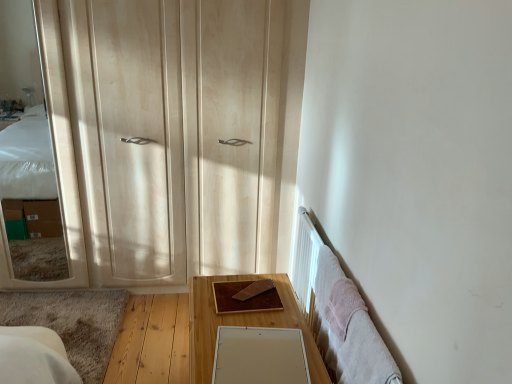
You are a GUI agent. You are given a task and a screenshot of the screen. Output one action in this format:
    pyautogui.click(x=<x>, y=<y>)
    Task: Click on the vacant point above brown wooden table at center (from a real-world perspective)
    The image size is (512, 384).
    Given the screenshot: What is the action you would take?
    pyautogui.click(x=238, y=315)